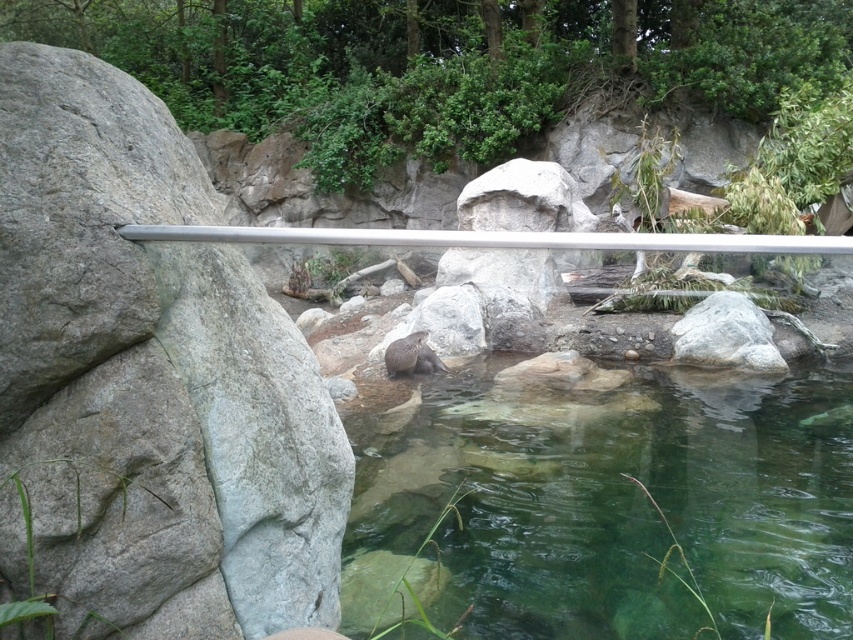
Question: Does clear glass water at center appear over brown furry otter at center?

Choices:
 (A) no
 (B) yes

Answer: (A)

Question: Based on their relative distances, which object is nearer to the gray rock at left?

Choices:
 (A) clear glass water at center
 (B) brown furry otter at center
 (C) silver metallic rail at center

Answer: (C)

Question: Can you confirm if clear glass water at center is positioned to the left of brown furry otter at center?

Choices:
 (A) yes
 (B) no

Answer: (B)

Question: Estimate the real-world distances between objects in this image. Which object is closer to the brown furry otter at center?

Choices:
 (A) silver metallic rail at center
 (B) gray rock at left

Answer: (A)

Question: Based on their relative distances, which object is nearer to the clear glass water at center?

Choices:
 (A) silver metallic rail at center
 (B) gray rock at left
 (C) brown furry otter at center

Answer: (C)

Question: Is silver metallic rail at center above brown furry otter at center?

Choices:
 (A) no
 (B) yes

Answer: (B)